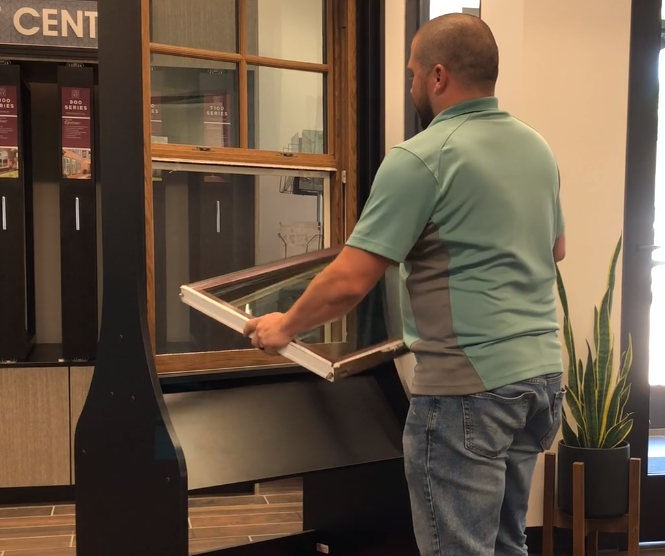
Identify the location of window. The height and width of the screenshot is (556, 665). (276, 297), (191, 232), (201, 100), (293, 24), (175, 24), (294, 123).